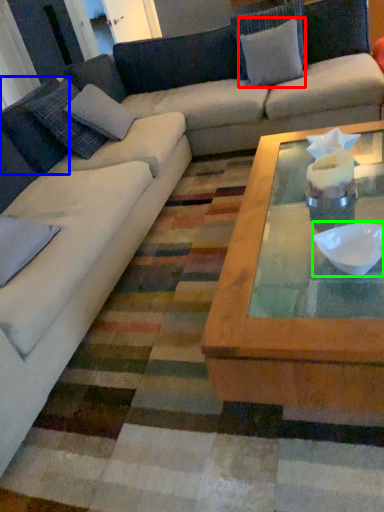
Question: Which is farther away from pillow (highlighted by a red box)? pillow (highlighted by a blue box) or bowl (highlighted by a green box)?

Choices:
 (A) pillow
 (B) bowl

Answer: (B)